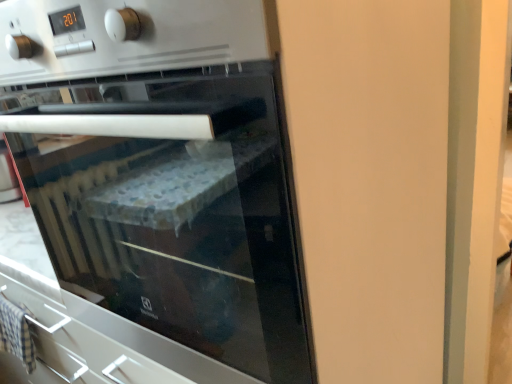
Question: Should I look upward or downward to see white glossy oven at center?

Choices:
 (A) down
 (B) up

Answer: (B)